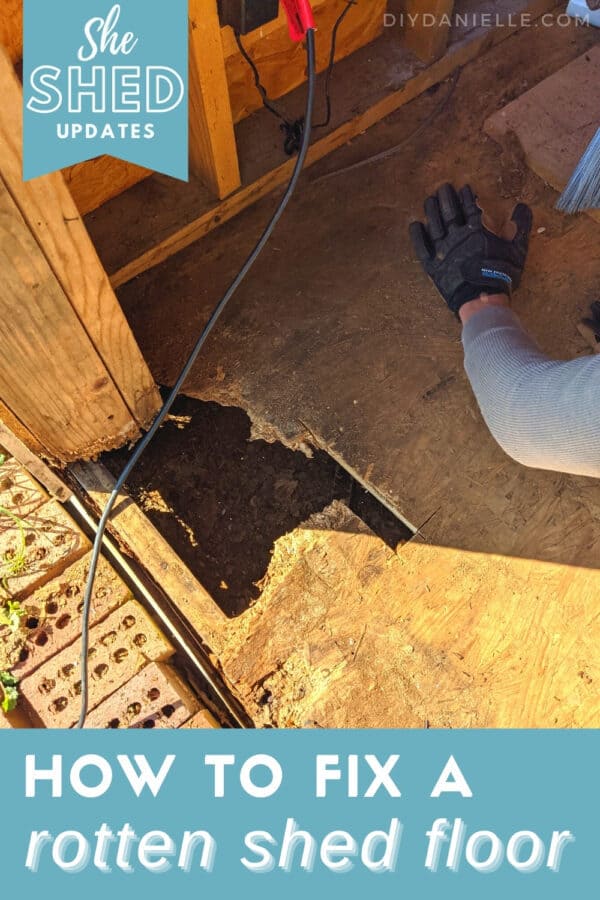
In order to click on electrical wire in this screenshot , I will do `click(311, 104)`, `click(297, 130)`.